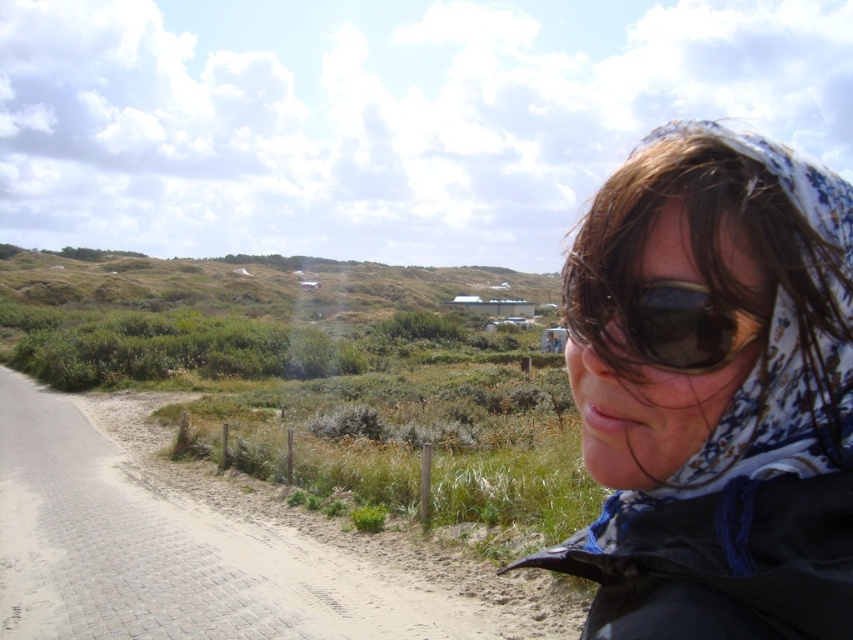
Question: Can you confirm if white floral scarf at upper right is positioned below black plastic sunglasses at center?

Choices:
 (A) no
 (B) yes

Answer: (B)

Question: Considering the relative positions of white floral scarf at upper right and black plastic sunglasses at center in the image provided, where is white floral scarf at upper right located with respect to black plastic sunglasses at center?

Choices:
 (A) left
 (B) right

Answer: (B)

Question: Is white floral scarf at upper right thinner than black plastic sunglasses at center?

Choices:
 (A) no
 (B) yes

Answer: (A)

Question: Which point is farther from the camera taking this photo?

Choices:
 (A) (641, 358)
 (B) (599, 284)

Answer: (B)

Question: Which point is closer to the camera?

Choices:
 (A) white floral scarf at upper right
 (B) black plastic sunglasses at center

Answer: (A)